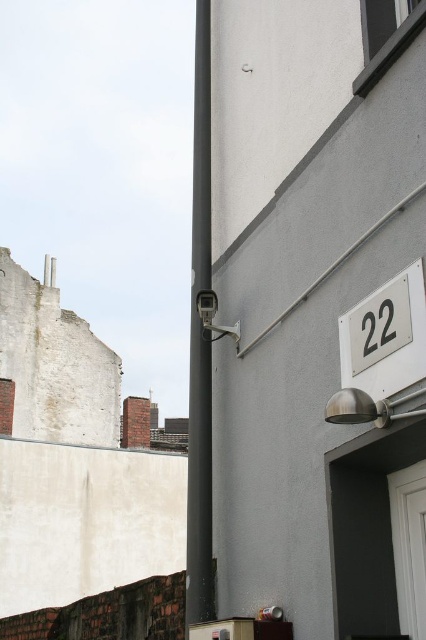
Question: Which object is the farthest from the white plastic number at upper right?

Choices:
 (A) white glossy number plate at right
 (B) black matte pole at center

Answer: (B)

Question: Does black matte pole at center have a smaller size compared to white plastic number at upper right?

Choices:
 (A) yes
 (B) no

Answer: (B)

Question: Which of the following is the farthest from the observer?

Choices:
 (A) black matte pole at center
 (B) white plastic number at upper right
 (C) white glossy number plate at right

Answer: (A)

Question: Is white glossy number plate at right further to camera compared to white plastic number at upper right?

Choices:
 (A) no
 (B) yes

Answer: (A)

Question: Which of the following is the farthest from the observer?

Choices:
 (A) white plastic number at upper right
 (B) black matte pole at center

Answer: (B)

Question: Can you confirm if black matte pole at center is bigger than white plastic number at upper right?

Choices:
 (A) yes
 (B) no

Answer: (A)